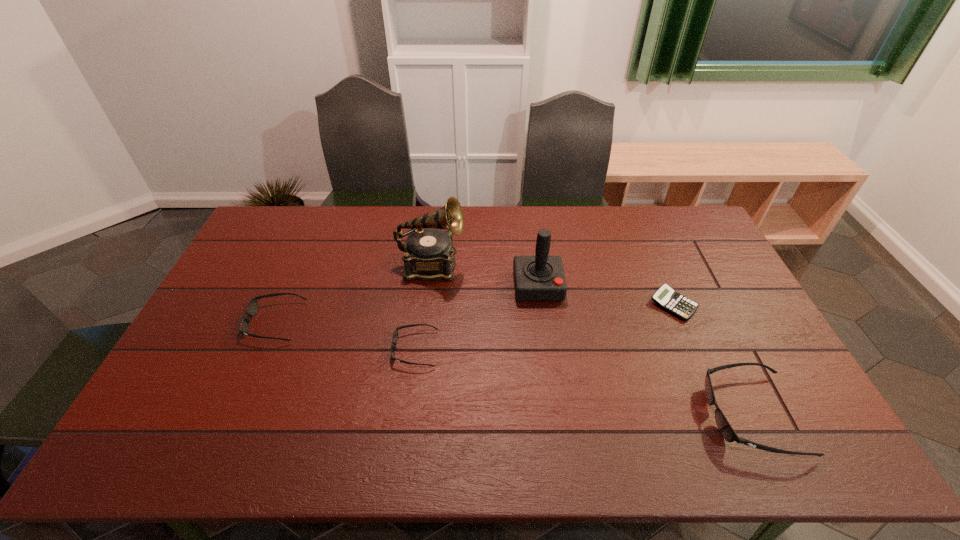
I want to click on blank space at the right edge, so click(x=735, y=354).

Identify the location of blank space at the near left corner. The image size is (960, 540). (167, 391).

What are the coordinates of `free space at the far right corner of the desktop` in the screenshot? It's located at (690, 231).

In the image, there is a desktop. Where is `blank space at the near right corner`? Image resolution: width=960 pixels, height=540 pixels. blank space at the near right corner is located at coordinates (749, 400).

At what (x,y) coordinates should I click in order to perform the action: click on free space between the second shortest object and the nearest object. Please return your answer as a coordinate pair (x, y). Looking at the image, I should click on (583, 382).

This screenshot has width=960, height=540. Identify the location of unoccupied area between the calculator and the joystick. (606, 295).

This screenshot has width=960, height=540. Identify the location of vacant space that is in between the nearest sunglasses and the fifth shortest object. (644, 350).

Image resolution: width=960 pixels, height=540 pixels. What are the coordinates of `vacant area that lies between the phonograph record and the fourth object from left to right` in the screenshot? It's located at (485, 276).

The height and width of the screenshot is (540, 960). Find the location of `vacant space that is in between the joystick and the tallest object`. vacant space that is in between the joystick and the tallest object is located at coordinates (485, 276).

Locate an element on the screen. This screenshot has height=540, width=960. vacant point located between the shortest sunglasses and the calculator is located at coordinates (544, 327).